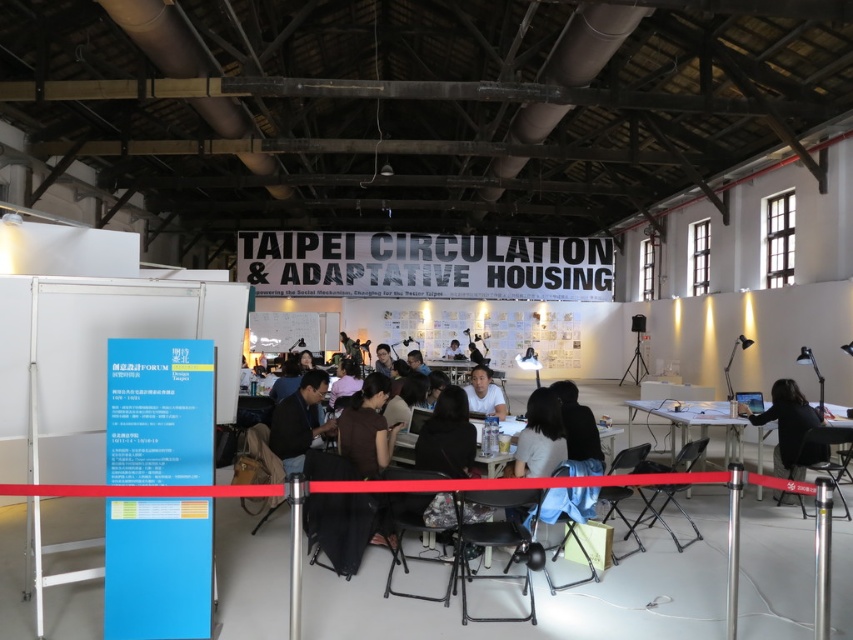
You are organizing a small workshop in this space and need to place a 10 feet long table between the white plastic table at right and the dark blue shirt at center. Is there enough space to place the table horizontally between them?

The distance between the white plastic table at right and the dark blue shirt at center is 11.82 feet. Since the table is 10 feet long, there is enough space to place it horizontally between them.